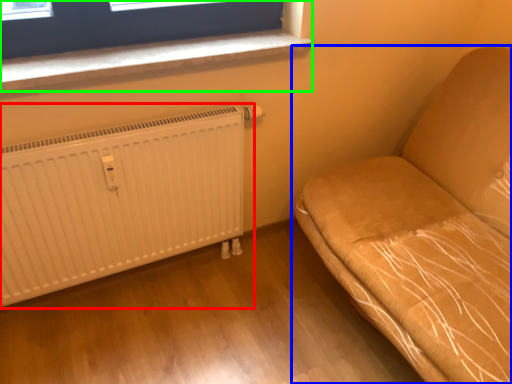
Question: Considering the real-world distances, which object is closest to radiator (highlighted by a red box)? furniture (highlighted by a blue box) or window (highlighted by a green box).

Choices:
 (A) furniture
 (B) window

Answer: (B)